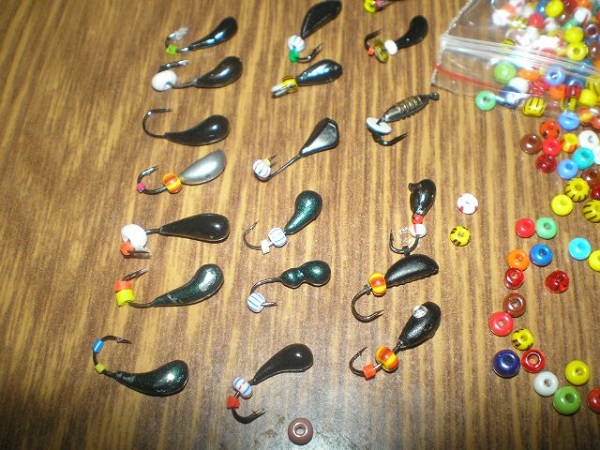
Locate an element on the screen. The image size is (600, 450). tiny orange and yellow striped round beads is located at coordinates (389, 359), (376, 286).